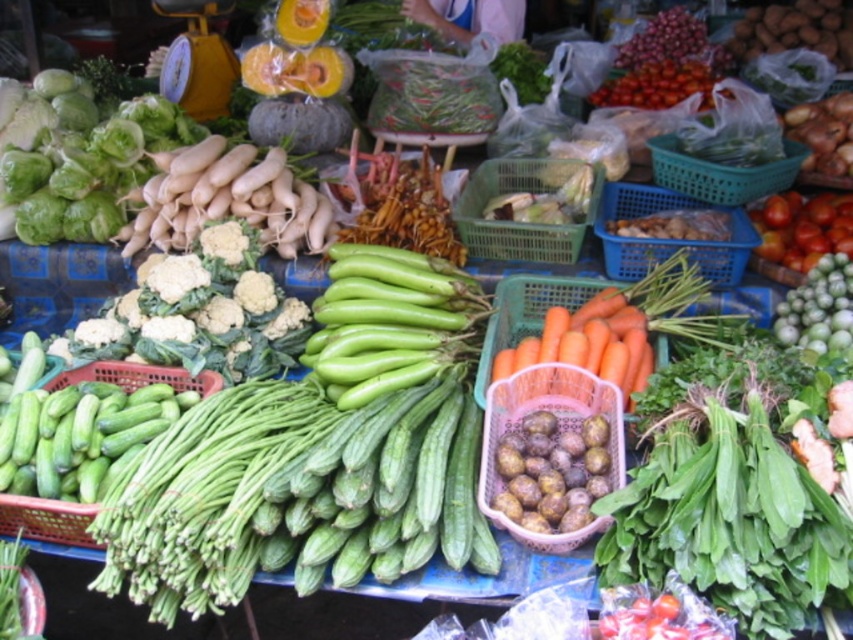
Does green plastic cucumbers at left appear on the right side of ripe red tomato at upper right?

In fact, green plastic cucumbers at left is to the left of ripe red tomato at upper right.

Who is lower down, green plastic cucumbers at left or ripe red tomato at upper right?

green plastic cucumbers at left is below.

Is point (180, 385) positioned after point (821, 209)?

No, it is in front of (821, 209).

This screenshot has width=853, height=640. I want to click on green plastic cucumbers at left, so click(45, 518).

Based on the photo, who is more distant from viewer, (550, 403) or (202, 390)?

Point (202, 390)

Find the location of `matte plastic basket at center right`. matte plastic basket at center right is located at coordinates (560, 417).

The height and width of the screenshot is (640, 853). Describe the element at coordinates (560, 417) in the screenshot. I see `matte plastic basket at center right` at that location.

Where is `matte plastic basket at center right`? This screenshot has width=853, height=640. matte plastic basket at center right is located at coordinates (560, 417).

Between green matte eggplant at center and green plastic cucumbers at left, which one appears on the left side from the viewer's perspective?

From the viewer's perspective, green plastic cucumbers at left appears more on the left side.

Locate an element on the screen. green matte eggplant at center is located at coordinates (386, 317).